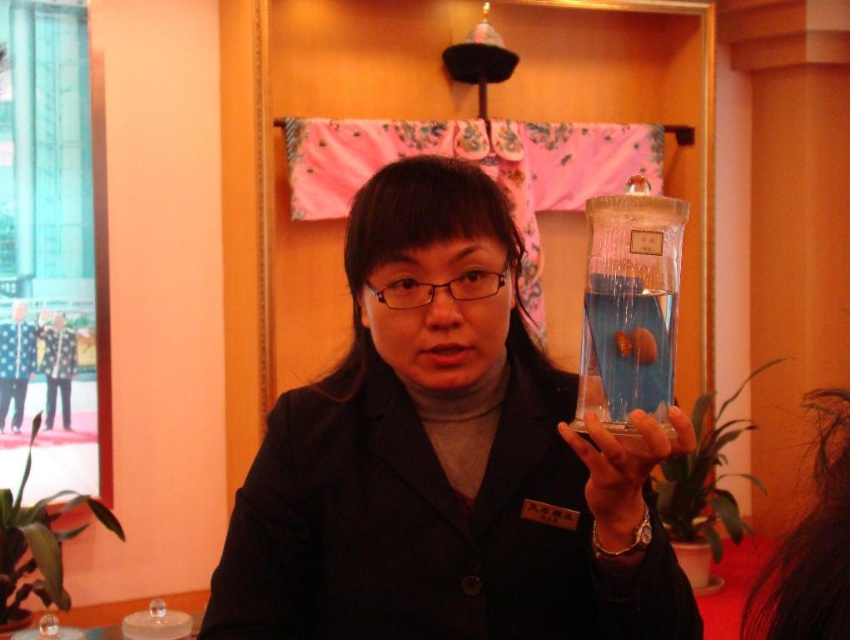
Is matte black jacket at center positioned in front of transparent glass bottle at center?

Yes, it is.

The image size is (850, 640). I want to click on matte black jacket at center, so click(445, 458).

Describe the element at coordinates (445, 458) in the screenshot. I see `matte black jacket at center` at that location.

Image resolution: width=850 pixels, height=640 pixels. I want to click on matte black jacket at center, so click(445, 458).